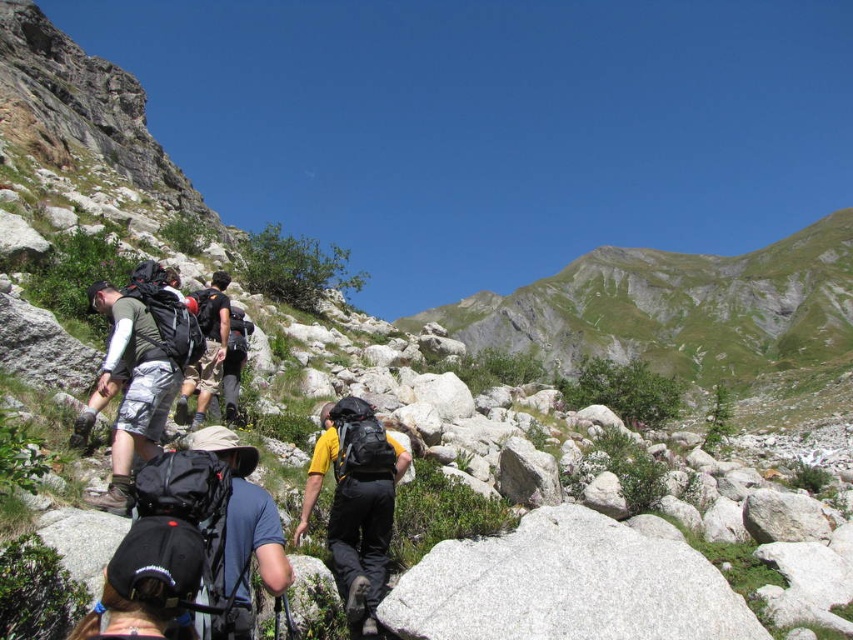
Is point (184, 561) positioned in front of point (227, 337)?

That is True.

Between black fabric cap at lower left and camouflage shorts at center, which one is positioned lower?

black fabric cap at lower left is lower down.

Between point (167, 552) and point (206, 388), which one is positioned in front?

Point (167, 552)

Where is `black fabric cap at lower left`? This screenshot has height=640, width=853. black fabric cap at lower left is located at coordinates (148, 580).

The height and width of the screenshot is (640, 853). What do you see at coordinates (137, 378) in the screenshot?
I see `camouflage shorts at left` at bounding box center [137, 378].

Who is more distant from viewer, [115,502] or [154,538]?

The point [115,502] is more distant.

The image size is (853, 640). What do you see at coordinates (137, 378) in the screenshot?
I see `camouflage shorts at left` at bounding box center [137, 378].

Locate an element on the screen. The width and height of the screenshot is (853, 640). camouflage shorts at left is located at coordinates (137, 378).

Based on the photo, is gray rocky mountain at upper center to the left of yellow matte backpack at center from the viewer's perspective?

In fact, gray rocky mountain at upper center is to the right of yellow matte backpack at center.

Who is higher up, gray rocky mountain at upper center or yellow matte backpack at center?

Positioned higher is gray rocky mountain at upper center.

Is point (733, 388) positioned behind point (294, 536)?

That is True.

Identify the location of gray rocky mountain at upper center. (691, 320).